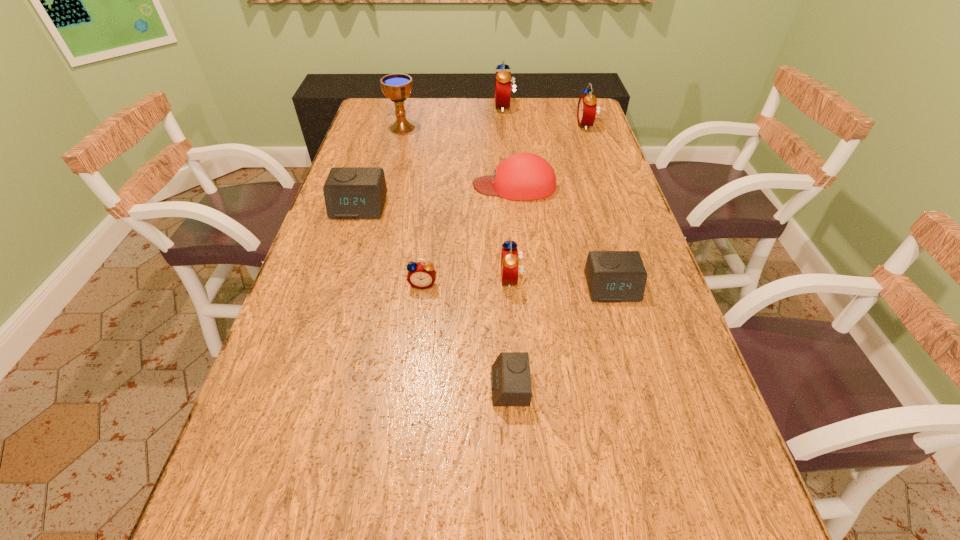
Find the location of a particular element. the farthest red alarm clock is located at coordinates (503, 78).

The width and height of the screenshot is (960, 540). Identify the location of the farthest alarm clock. (503, 78).

Where is `chalice`? chalice is located at coordinates (397, 87).

Identify the location of the third smallest red alarm clock. (586, 112).

This screenshot has height=540, width=960. I want to click on the second farthest red alarm clock, so click(586, 112).

The image size is (960, 540). I want to click on the second smallest red alarm clock, so click(x=509, y=255).

Where is `baseball cap`? baseball cap is located at coordinates (525, 176).

You are a GUI agent. You are given a task and a screenshot of the screen. Output one action in this format:
    pyautogui.click(x=<x>, y=<y>)
    Task: Click on the leftmost alarm clock
    
    Given the screenshot: What is the action you would take?
    pyautogui.click(x=350, y=192)

At what (x,y) coordinates should I click in order to perform the action: click on the farthest black alarm clock. Please return your answer as a coordinate pair (x, y). The width and height of the screenshot is (960, 540). Looking at the image, I should click on (350, 192).

Find the location of `the sixth alarm clock from right to left`. the sixth alarm clock from right to left is located at coordinates (421, 275).